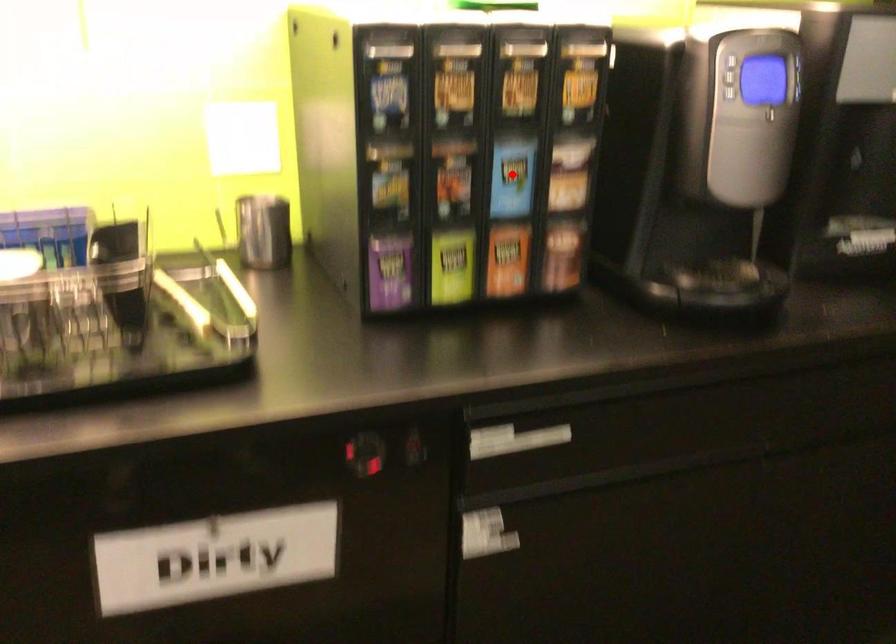
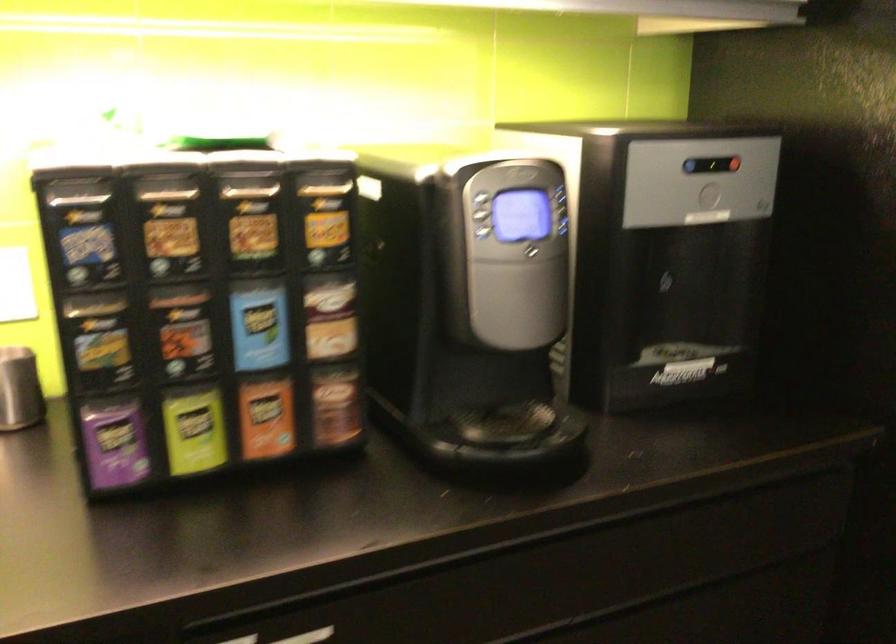
Question: I am providing you with two images of the same scene from different viewpoints. A red point is shown in image1. For the corresponding object point in image2, is it positioned nearer or farther from the camera?

Choices:
 (A) Nearer
 (B) Farther

Answer: (A)